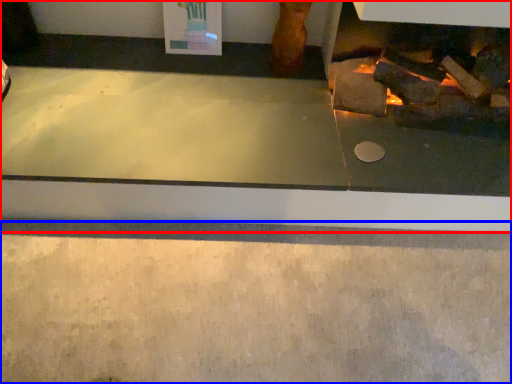
Question: Which object is closer to the camera taking this photo, fireplace (highlighted by a red box) or concrete (highlighted by a blue box)?

Choices:
 (A) fireplace
 (B) concrete

Answer: (B)